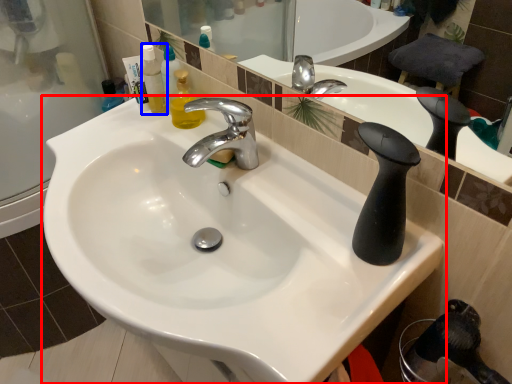
Question: Among these objects, which one is nearest to the camera, sink (highlighted by a red box) or mouthwash (highlighted by a blue box)?

Choices:
 (A) sink
 (B) mouthwash

Answer: (A)